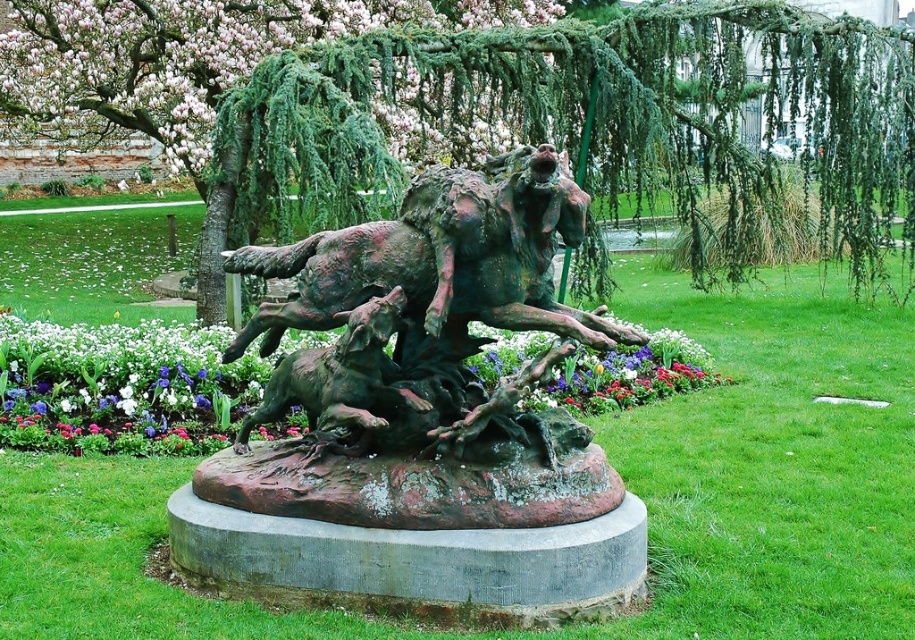
Question: Which object is farther from the camera taking this photo?

Choices:
 (A) pink blossoms at upper left
 (B) bronze textured dog at center

Answer: (A)

Question: Which of the following is the farthest from the observer?

Choices:
 (A) (530, 486)
 (B) (51, 401)
 (C) (428, 406)
 (D) (241, 6)

Answer: (D)

Question: Can you confirm if rusty bronze horse at center is bigger than pink blossoms at upper left?

Choices:
 (A) yes
 (B) no

Answer: (B)

Question: Which point appears farthest from the camera in this image?

Choices:
 (A) (216, 445)
 (B) (449, 362)
 (C) (347, 353)
 (D) (108, 134)

Answer: (D)

Question: Is rusty bronze horse at center below pink blossoms at upper left?

Choices:
 (A) no
 (B) yes

Answer: (B)

Question: Is bronze textured dog at center to the right of multicolored fabric flowers at center from the viewer's perspective?

Choices:
 (A) no
 (B) yes

Answer: (A)